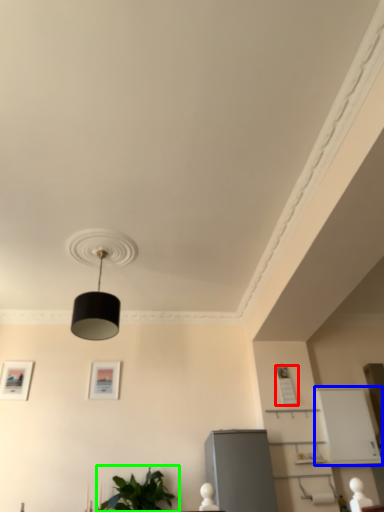
Question: Which is nearer to the picture frame (highlighted by a red box)? shelf (highlighted by a blue box) or houseplant (highlighted by a green box).

Choices:
 (A) shelf
 (B) houseplant

Answer: (A)